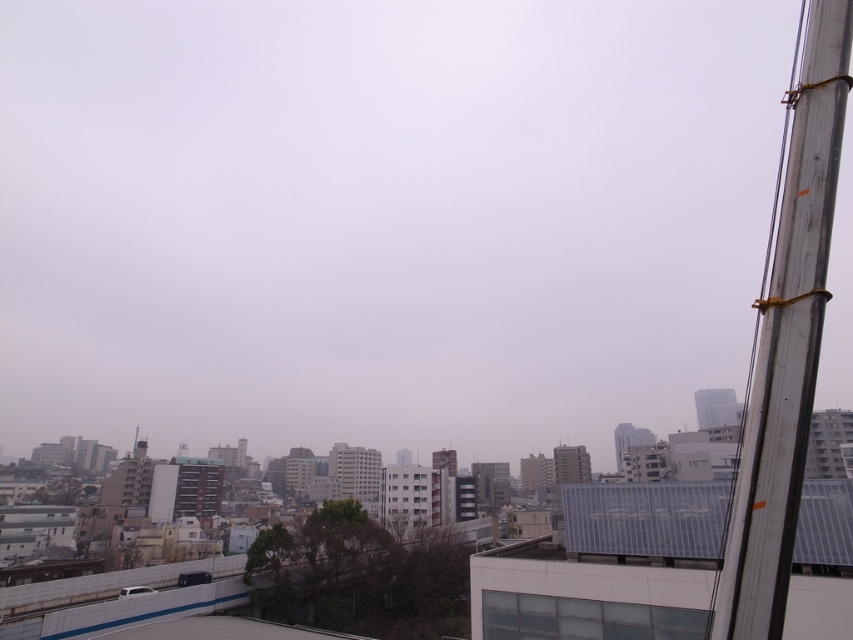
Question: Which object is closer to the camera taking this photo?

Choices:
 (A) transparent glass window at lower center
 (B) metallic gray pole at right

Answer: (B)

Question: Does metallic gray pole at right appear on the left side of transparent glass window at lower center?

Choices:
 (A) no
 (B) yes

Answer: (A)

Question: Among these points, which one is nearest to the camera?

Choices:
 (A) (807, 340)
 (B) (646, 627)

Answer: (A)

Question: Which point is farther to the camera?

Choices:
 (A) transparent glass window at lower center
 (B) metallic gray pole at right

Answer: (A)

Question: Is metallic gray pole at right to the left of transparent glass window at lower center from the viewer's perspective?

Choices:
 (A) no
 (B) yes

Answer: (A)

Question: Can you confirm if metallic gray pole at right is smaller than transparent glass window at lower center?

Choices:
 (A) yes
 (B) no

Answer: (B)